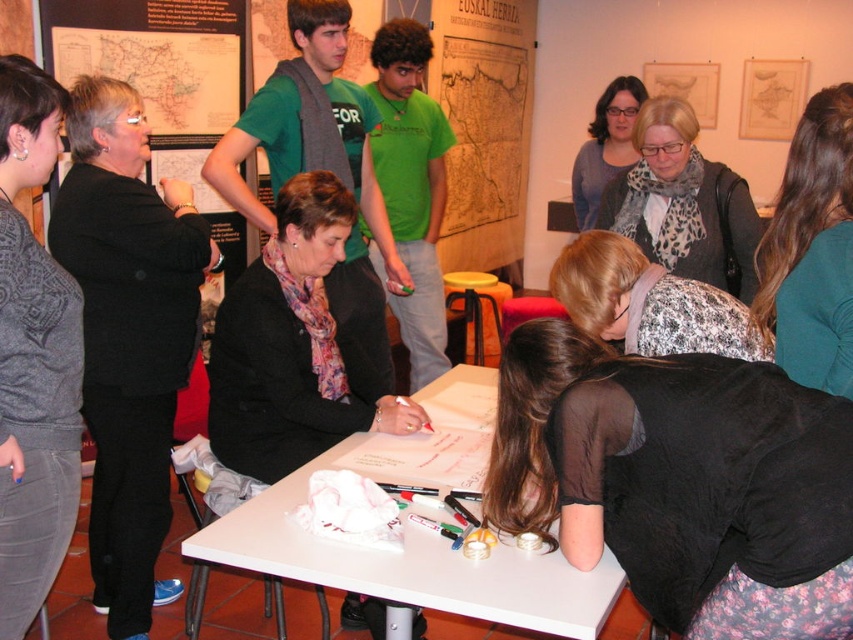
Between point (128, 307) and point (459, 589), which one is positioned behind?

Point (128, 307)

Between black matte jacket at upper left and white plastic table at center, which one is positioned lower?

white plastic table at center is lower down.

Locate an element on the screen. This screenshot has height=640, width=853. black matte jacket at upper left is located at coordinates (128, 336).

Which is more to the left, gray textured sweater at left or white plastic table at center?

gray textured sweater at left is more to the left.

Which of these two, gray textured sweater at left or white plastic table at center, stands taller?

Standing taller between the two is gray textured sweater at left.

Does point (44, 420) lie in front of point (305, 570)?

No, it is behind (305, 570).

Locate an element on the screen. This screenshot has width=853, height=640. gray textured sweater at left is located at coordinates (33, 358).

Between black matte jacket at upper left and teal sweater at lower right, which one has less height?

Standing shorter between the two is teal sweater at lower right.

Describe the element at coordinates (128, 336) in the screenshot. Image resolution: width=853 pixels, height=640 pixels. I see `black matte jacket at upper left` at that location.

Where is `black matte jacket at upper left`? The width and height of the screenshot is (853, 640). black matte jacket at upper left is located at coordinates (128, 336).